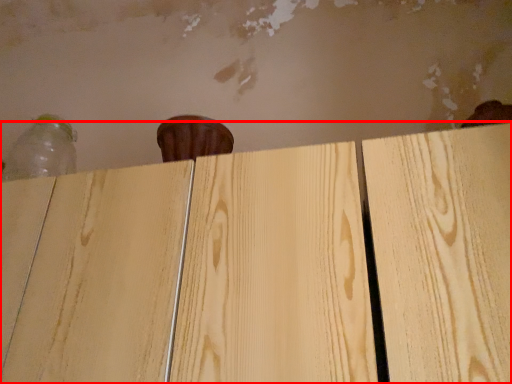
Question: From the image's perspective, what is the correct spatial positioning of plywood (annotated by the red box) in reference to bottle?

Choices:
 (A) below
 (B) above

Answer: (A)